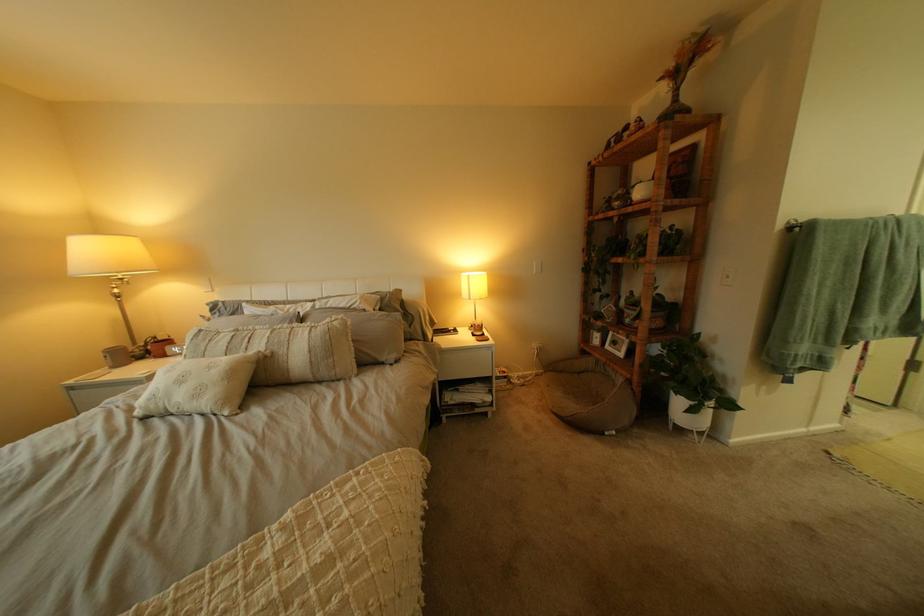
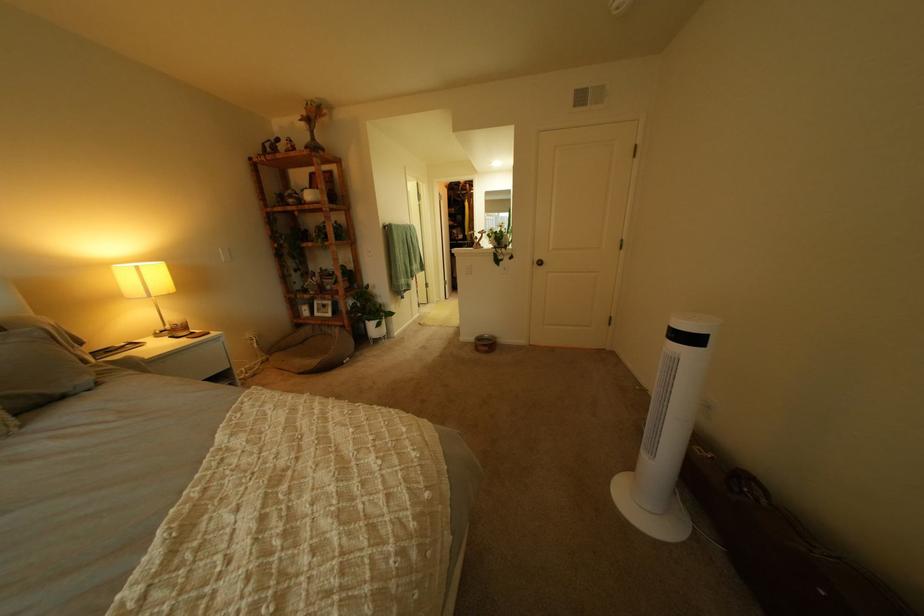
Question: The first image is from the beginning of the video and the second image is from the end. How did the camera likely rotate when shooting the video?

Choices:
 (A) Left
 (B) Right
 (C) Up
 (D) Down

Answer: (B)